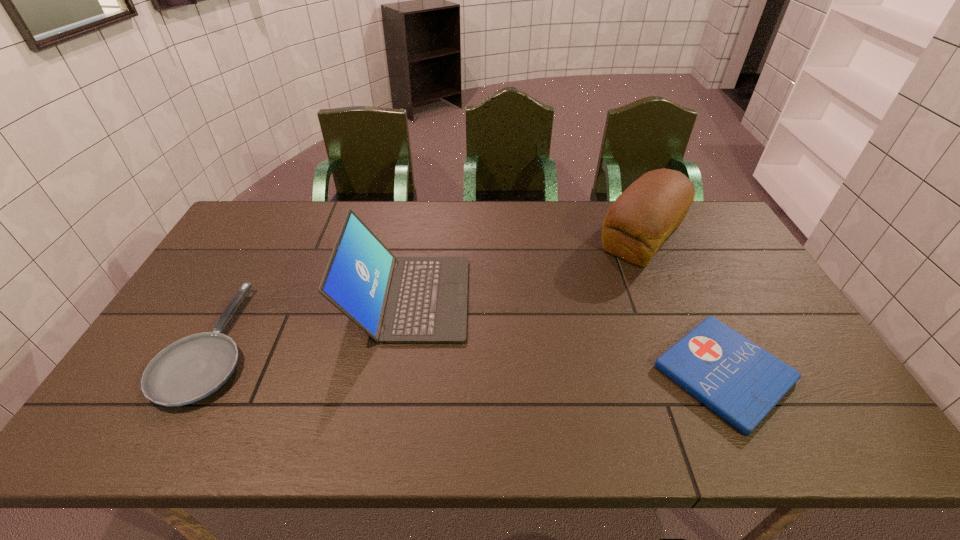
Where is `frying pan that is positioned at the near edge`? frying pan that is positioned at the near edge is located at coordinates (192, 368).

You are a GUI agent. You are given a task and a screenshot of the screen. Output one action in this format:
    pyautogui.click(x=<x>, y=<y>)
    Task: Click on the first-aid kit that is at the near edge
    
    Given the screenshot: What is the action you would take?
    (738, 380)

I want to click on object located in the left edge section of the desktop, so click(x=192, y=368).

At what (x,y) coordinates should I click in order to perform the action: click on bread positioned at the right edge. Please return your answer as a coordinate pair (x, y). Looking at the image, I should click on (639, 221).

Identify the location of the first-aid kit located at the right edge. (738, 380).

Where is `object located at the near left corner`? object located at the near left corner is located at coordinates [192, 368].

You are a GUI agent. You are given a task and a screenshot of the screen. Output one action in this format:
    pyautogui.click(x=<x>, y=<y>)
    Task: Click on the object that is at the far right corner
    The image size is (960, 540).
    Given the screenshot: What is the action you would take?
    pyautogui.click(x=639, y=221)

Find the location of `object at the near right corner`. object at the near right corner is located at coordinates (x=738, y=380).

You are a GUI agent. You are given a task and a screenshot of the screen. Output one action in this format:
    pyautogui.click(x=<x>, y=<y>)
    Task: Click on the vacant area at the far edge of the desktop
    This screenshot has height=540, width=960.
    Given the screenshot: What is the action you would take?
    pyautogui.click(x=554, y=231)

What are the coordinates of `vacant space at the near edge of the desktop` in the screenshot? It's located at coord(627,416).